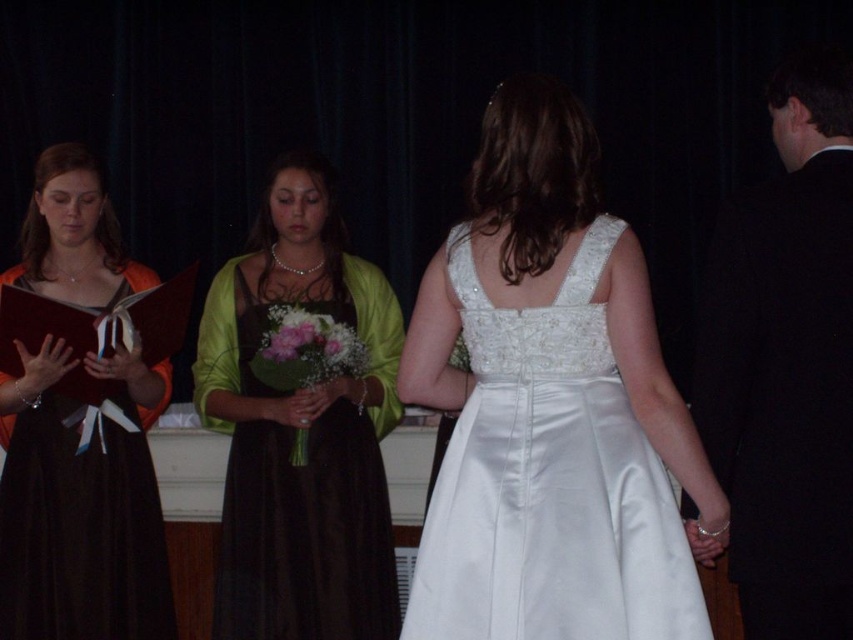
You are a photographer at a formal event. You need to position two bridesmaids, one wearing the matte brown dress at center and the other in the matte orange dress at left, so that their dresses are visible in the photo. Based on their current positions, which bridesmaid is standing higher in the frame?

The matte brown dress at center is above the matte orange dress at left, so the bridesmaid in the matte brown dress at center is standing higher in the frame.

You are a photographer at a formal event. You need to capture a photo that includes both the black satin suit at right and the matte orange dress at left. Based on their positions, which one is closer to the camera?

The black satin suit at right is closer to the camera since it is in front of the matte orange dress at left.

You are a photographer at this event. You need to position yourself so that both the black satin suit at right and the matte brown dress at center are visible in your shot. Given their sizes, which one should you focus on to ensure both are fully captured?

Since the black satin suit at right is smaller in size compared to the matte brown dress at center, you should focus on positioning the camera to include the larger matte brown dress at center first, then adjust to include the smaller black satin suit at right in the frame.